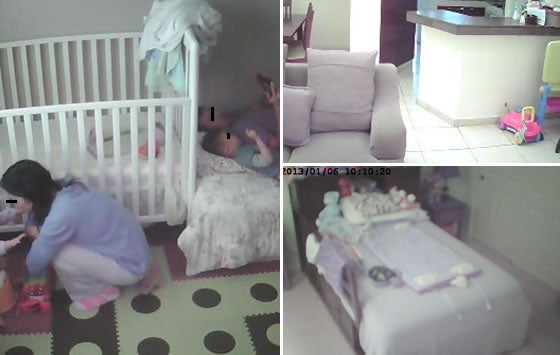
Find the location of a particular element. This screenshot has width=560, height=355. couch is located at coordinates (375, 125).